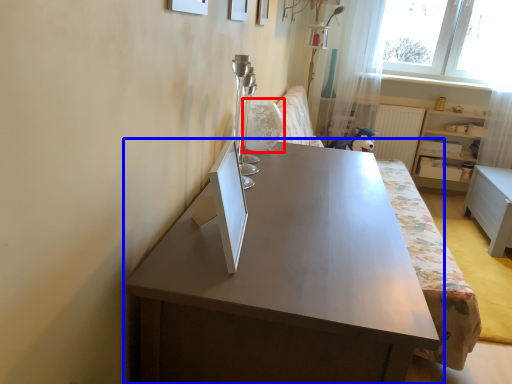
Question: Among these objects, which one is nearest to the camera, swivel chair (highlighted by a red box) or table (highlighted by a blue box)?

Choices:
 (A) swivel chair
 (B) table

Answer: (B)